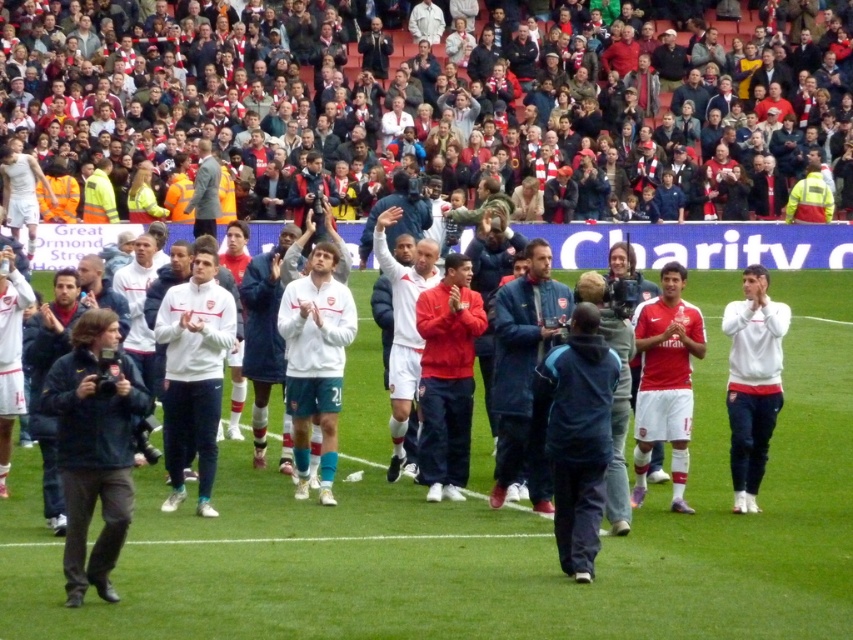
You are a photographer standing at the edge of the pitch. You want to take a photo of both the white matte jacket at center and the blue fabric jacket at center in the same frame. The camera you are using has a maximum focus range of 1.6 meters. Will both jackets be in focus?

The white matte jacket at center and blue fabric jacket at center are 1.70 meters apart from each other. Since the distance between them exceeds the camera maximum focus range of 1.6 meters, the camera cannot focus on both jackets simultaneously.

You are a photographer at the stadium and want to capture a photo that includes both the red scarf at upper center and the white matte jacket at center. Which object should you focus on first to ensure both are in the frame?

You should focus on the white matte jacket at center first because the red scarf at upper center is located above it, ensuring both will be captured when framing the jacket and adjusting upwards.

You are a photographer standing at the center of the stadium. You want to take a photo that includes both the point at (x=329, y=102) and the point at (x=231, y=426). Which point is closer to your camera lens?

Point at (x=329, y=102) is closer to the camera lens because it is further to the viewer than point at (x=231, y=426).